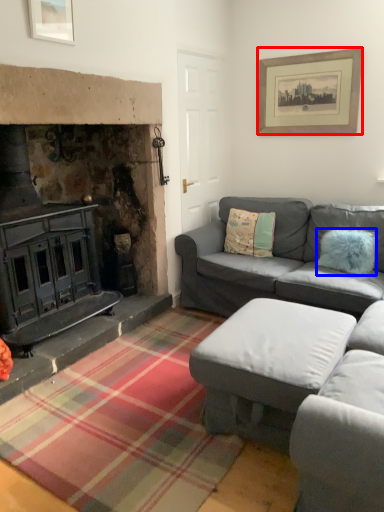
Question: Which of the following is the closest to the observer, picture frame (highlighted by a red box) or pillow (highlighted by a blue box)?

Choices:
 (A) picture frame
 (B) pillow

Answer: (B)